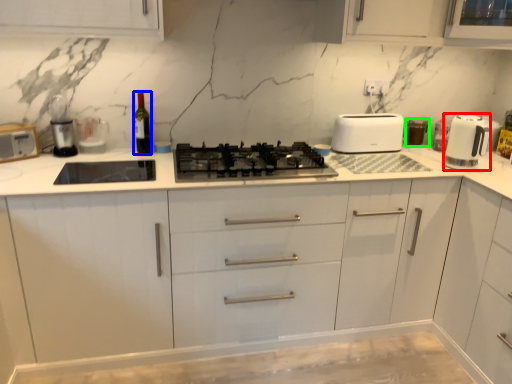
Question: Which object is positioned closest to home appliance (highlighted by a red box)? Select from wine bottle (highlighted by a blue box) and appliance (highlighted by a green box).

Choices:
 (A) wine bottle
 (B) appliance

Answer: (B)